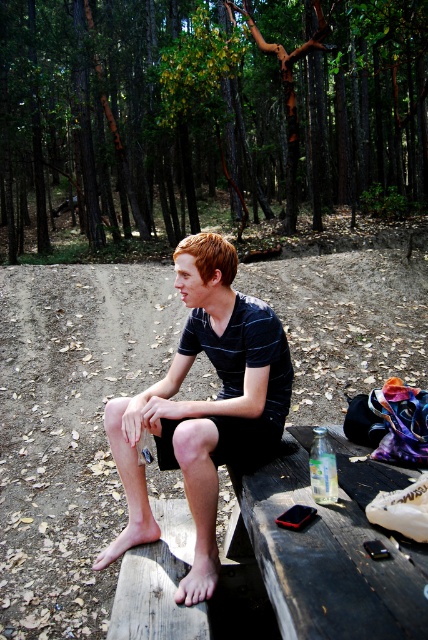
Question: Can you confirm if brown dirt track at center is positioned to the left of wooden picnic table at center?

Choices:
 (A) no
 (B) yes

Answer: (B)

Question: Where is brown bark trees at upper center located in relation to brown dirt track at center in the image?

Choices:
 (A) below
 (B) above

Answer: (B)

Question: Among these objects, which one is nearest to the camera?

Choices:
 (A) brown dirt track at center
 (B) wooden picnic table at center
 (C) black striped shirt at center

Answer: (B)

Question: Is brown bark trees at upper center smaller than wooden picnic table at center?

Choices:
 (A) no
 (B) yes

Answer: (A)

Question: Estimate the real-world distances between objects in this image. Which object is farther from the brown dirt track at center?

Choices:
 (A) black striped shirt at center
 (B) brown bark trees at upper center
 (C) wooden picnic table at center

Answer: (B)

Question: Based on their relative distances, which object is farther from the brown dirt track at center?

Choices:
 (A) brown bark trees at upper center
 (B) black striped shirt at center
 (C) wooden picnic table at center

Answer: (A)